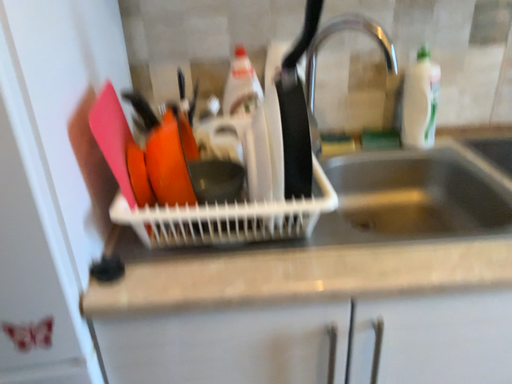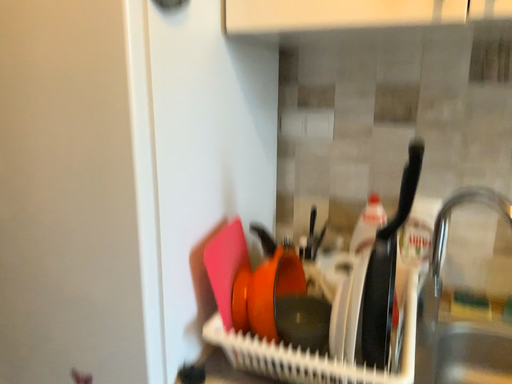
Question: Which way did the camera rotate in the video?

Choices:
 (A) rotated left
 (B) rotated right

Answer: (A)